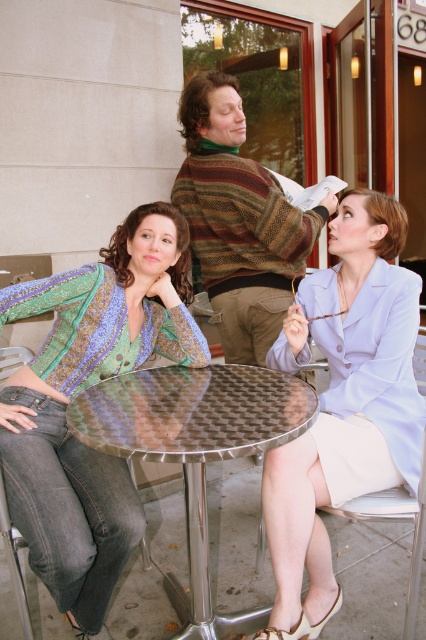
Question: Which of the following is the closest to the observer?

Choices:
 (A) metallic hexagonal table at center
 (B) patterned fabric blouse at center
 (C) white fabric chair at lower right
 (D) striped sweater at center

Answer: (A)

Question: Is patterned fabric blouse at center to the right of white fabric chair at lower right from the viewer's perspective?

Choices:
 (A) yes
 (B) no

Answer: (B)

Question: Does patterned fabric blouse at center appear over light blue fabric jacket at center?

Choices:
 (A) yes
 (B) no

Answer: (A)

Question: Which of these objects is positioned closest to the white fabric chair at lower right?

Choices:
 (A) light blue fabric jacket at center
 (B) striped sweater at center
 (C) patterned fabric blouse at center
 (D) metallic hexagonal table at center

Answer: (A)

Question: Is light blue fabric jacket at center positioned behind white fabric chair at lower right?

Choices:
 (A) yes
 (B) no

Answer: (B)

Question: Which of these objects is positioned closest to the white fabric chair at lower right?

Choices:
 (A) light blue fabric jacket at center
 (B) patterned fabric blouse at center
 (C) metallic hexagonal table at center

Answer: (A)